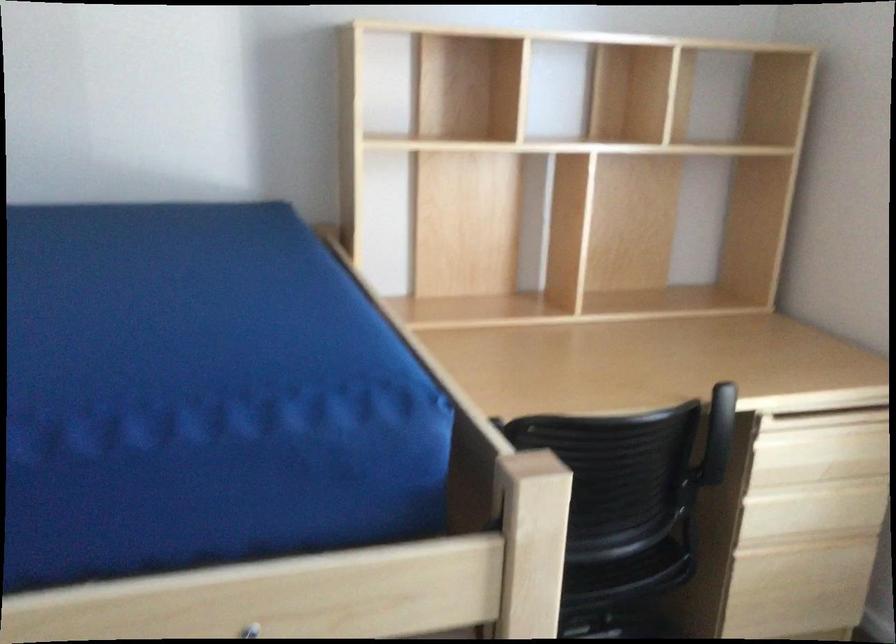
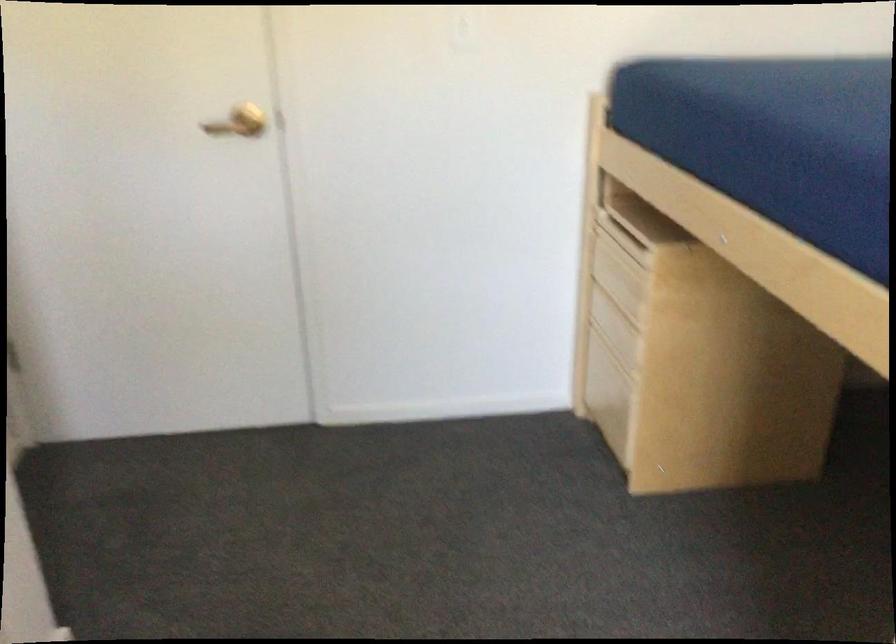
The first image is from the beginning of the video and the second image is from the end. How did the camera likely rotate when shooting the video?

The camera rotated toward left-down.